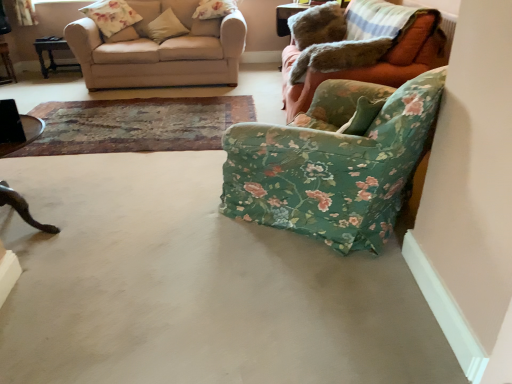
Question: From a real-world perspective, is beige fabric couch at upper left, the second studio couch when ordered from right to left, positioned over wooden dark brown table at left, marked as the third table in a top-to-bottom arrangement, based on gravity?

Choices:
 (A) no
 (B) yes

Answer: (B)

Question: Can you confirm if beige fabric couch at upper left, the 1th studio couch from the left, is positioned to the left of wooden dark brown table at left, which is counted as the 1th table, starting from the front?

Choices:
 (A) no
 (B) yes

Answer: (A)

Question: Does beige fabric couch at upper left, the 1th studio couch from the left, have a lesser height compared to wooden dark brown table at left, marked as the third table in a top-to-bottom arrangement?

Choices:
 (A) no
 (B) yes

Answer: (A)

Question: Does beige fabric couch at upper left, the 1th studio couch from the left, come behind wooden dark brown table at left, the third table viewed from the left?

Choices:
 (A) yes
 (B) no

Answer: (A)

Question: From the image's perspective, does beige fabric couch at upper left, the 1th studio couch from the left, appear lower than wooden dark brown table at left, marked as the third table in a top-to-bottom arrangement?

Choices:
 (A) no
 (B) yes

Answer: (A)

Question: Is beige fabric couch at upper left, the second studio couch when ordered from right to left, situated inside floral fabric armchair at right, which appears as the 1th studio couch when viewed from the right, or outside?

Choices:
 (A) outside
 (B) inside

Answer: (A)

Question: Visually, is beige fabric couch at upper left, the second studio couch when ordered from right to left, positioned to the left or to the right of floral fabric armchair at right, placed as the 2th studio couch when sorted from left to right?

Choices:
 (A) right
 (B) left

Answer: (B)

Question: Considering their positions, is beige fabric couch at upper left, the 1th studio couch from the left, located in front of or behind floral fabric armchair at right, placed as the 2th studio couch when sorted from left to right?

Choices:
 (A) behind
 (B) front

Answer: (A)

Question: Is point (79, 44) positioned closer to the camera than point (436, 44)?

Choices:
 (A) farther
 (B) closer

Answer: (A)

Question: In terms of height, does brushed metal table at left, the second table positioned from the top, look taller or shorter compared to wooden dark brown table at left, the third table viewed from the left?

Choices:
 (A) tall
 (B) short

Answer: (B)

Question: From a real-world perspective, is brushed metal table at left, marked as the second table in a front-to-back arrangement, positioned above or below wooden dark brown table at left, positioned as the 1th table in right-to-left order?

Choices:
 (A) above
 (B) below

Answer: (B)

Question: Is brushed metal table at left, the second table in the back-to-front sequence, situated inside wooden dark brown table at left, marked as the third table in a top-to-bottom arrangement, or outside?

Choices:
 (A) inside
 (B) outside

Answer: (B)

Question: Considering their positions, is brushed metal table at left, marked as the second table in a front-to-back arrangement, located in front of or behind wooden dark brown table at left, marked as the third table in a top-to-bottom arrangement?

Choices:
 (A) behind
 (B) front

Answer: (A)

Question: From the image's perspective, is beige fabric couch at upper left, the second studio couch when ordered from right to left, positioned above or below wooden dark brown table at left, positioned as the 1th table in right-to-left order?

Choices:
 (A) below
 (B) above

Answer: (B)

Question: Considering their positions, is beige fabric couch at upper left, the 1th studio couch from the left, located in front of or behind wooden dark brown table at left, positioned as the 1th table in right-to-left order?

Choices:
 (A) front
 (B) behind

Answer: (B)